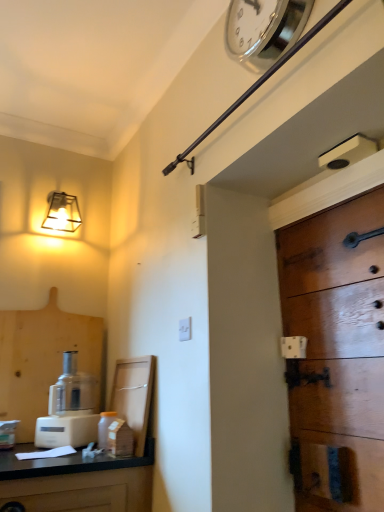
Question: Is metallic square lamp at upper left oriented away from silver metallic clock at upper center?

Choices:
 (A) no
 (B) yes

Answer: (A)

Question: Is metallic square lamp at upper left located outside silver metallic clock at upper center?

Choices:
 (A) yes
 (B) no

Answer: (A)

Question: Considering the relative sizes of metallic square lamp at upper left and silver metallic clock at upper center in the image provided, is metallic square lamp at upper left wider than silver metallic clock at upper center?

Choices:
 (A) no
 (B) yes

Answer: (B)

Question: Is metallic square lamp at upper left smaller than silver metallic clock at upper center?

Choices:
 (A) yes
 (B) no

Answer: (B)

Question: From the image's perspective, is metallic square lamp at upper left located beneath silver metallic clock at upper center?

Choices:
 (A) yes
 (B) no

Answer: (A)

Question: In terms of width, does white plastic food processor at lower left look wider or thinner when compared to white plastic light switch at center?

Choices:
 (A) wide
 (B) thin

Answer: (A)

Question: Visually, is white plastic food processor at lower left positioned to the left or to the right of white plastic light switch at center?

Choices:
 (A) left
 (B) right

Answer: (A)

Question: Is white plastic food processor at lower left bigger or smaller than white plastic light switch at center?

Choices:
 (A) big
 (B) small

Answer: (A)

Question: From a real-world perspective, is white plastic food processor at lower left above or below white plastic light switch at center?

Choices:
 (A) below
 (B) above

Answer: (A)

Question: Considering the positions of wooden cabinet at lower left and wooden door at right in the image, is wooden cabinet at lower left wider or thinner than wooden door at right?

Choices:
 (A) wide
 (B) thin

Answer: (A)

Question: Visually, is wooden cabinet at lower left positioned to the left or to the right of wooden door at right?

Choices:
 (A) right
 (B) left

Answer: (B)

Question: From the image's perspective, relative to wooden door at right, is wooden cabinet at lower left above or below?

Choices:
 (A) above
 (B) below

Answer: (B)

Question: Is wooden cabinet at lower left inside or outside of wooden door at right?

Choices:
 (A) inside
 (B) outside

Answer: (B)

Question: From their relative heights in the image, would you say translucent glass jar at lower left is taller or shorter than white plastic light switch at center?

Choices:
 (A) tall
 (B) short

Answer: (A)

Question: In the image, is translucent glass jar at lower left on the left side or the right side of white plastic light switch at center?

Choices:
 (A) left
 (B) right

Answer: (A)